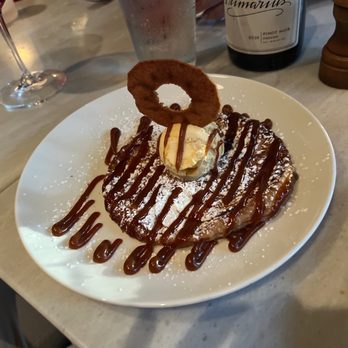
The image size is (348, 348). What are the coordinates of `pepper grinder` in the screenshot? It's located at (335, 60).